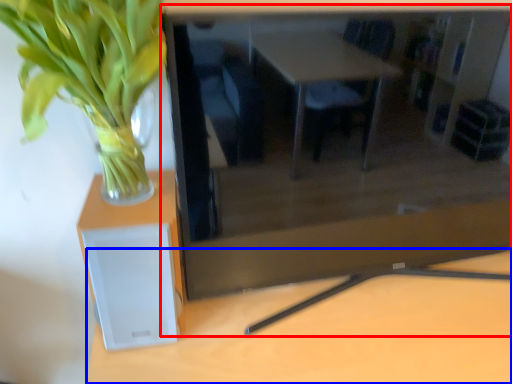
Question: Among these objects, which one is nearest to the camera, computer desk (highlighted by a red box) or table (highlighted by a blue box)?

Choices:
 (A) computer desk
 (B) table

Answer: (A)